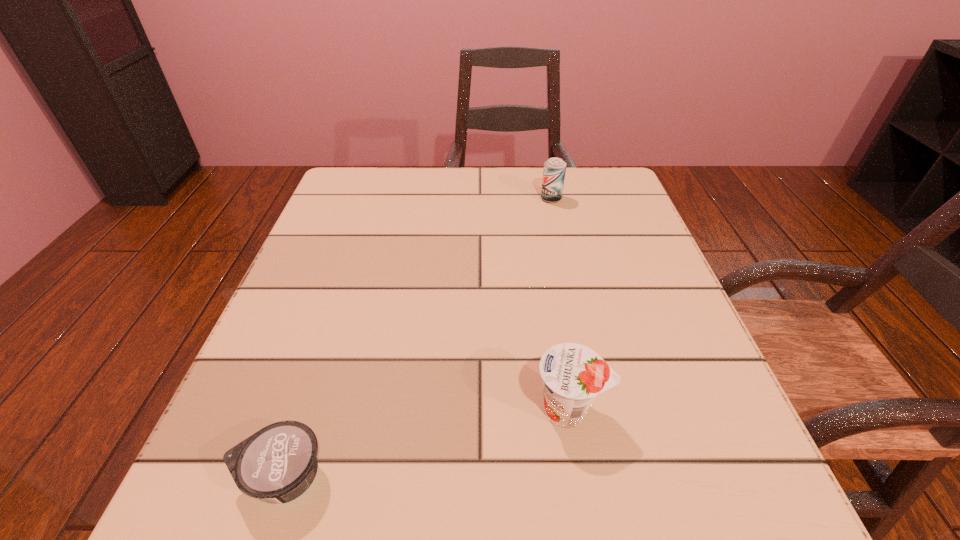
Where is `the farthest object`? The height and width of the screenshot is (540, 960). the farthest object is located at coordinates (554, 170).

Where is `the farther yogurt`? The width and height of the screenshot is (960, 540). the farther yogurt is located at coordinates (573, 375).

Locate an element on the screen. the taller yogurt is located at coordinates (573, 375).

Locate an element on the screen. the left yogurt is located at coordinates (277, 464).

Find the location of a particular element. The image size is (960, 540). the shorter yogurt is located at coordinates (277, 464).

You are a GUI agent. You are given a task and a screenshot of the screen. Output one action in this format:
    pyautogui.click(x=<x>, y=<y>)
    Task: Click on the vacant region located 0.370m on the front of the farthest object
    The image size is (960, 540).
    Given the screenshot: What is the action you would take?
    pyautogui.click(x=579, y=322)

This screenshot has width=960, height=540. Find the location of `free spot located 0.120m on the back of the right yogurt`. free spot located 0.120m on the back of the right yogurt is located at coordinates (555, 324).

At what (x,y) coordinates should I click in order to perform the action: click on free space located on the right of the shorter yogurt. Please return your answer as a coordinate pair (x, y). This screenshot has width=960, height=540. Looking at the image, I should click on (461, 477).

Find the location of a particular element. This screenshot has width=960, height=540. object that is positioned at the far edge is located at coordinates (554, 170).

Identify the location of object present at the near edge. (277, 464).